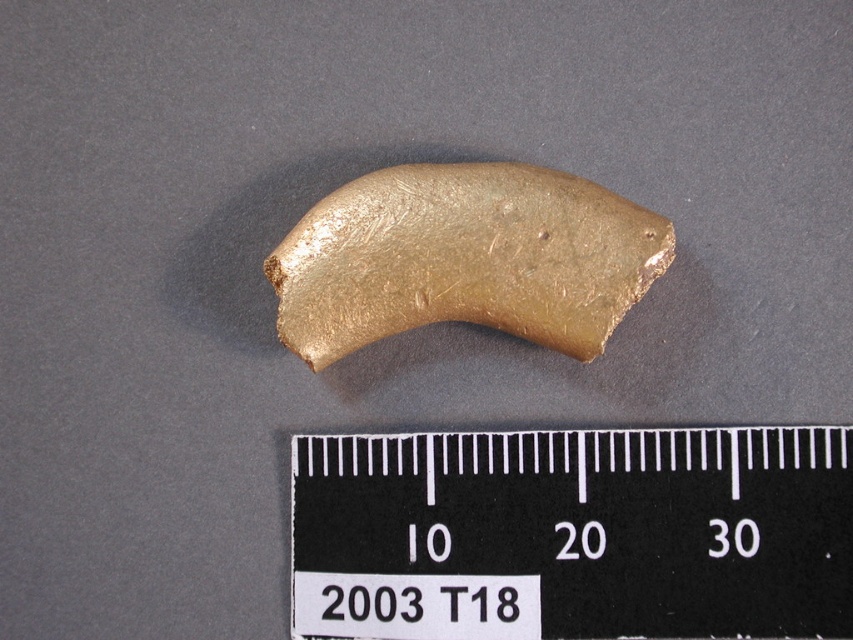
Question: Can you confirm if black plastic ruler at center is smaller than gold metallic arc at center?

Choices:
 (A) no
 (B) yes

Answer: (A)

Question: Does black plastic ruler at center lie in front of gold metallic arc at center?

Choices:
 (A) yes
 (B) no

Answer: (A)

Question: Is black plastic ruler at center positioned behind gold metallic arc at center?

Choices:
 (A) no
 (B) yes

Answer: (A)

Question: Which point is closer to the camera taking this photo?

Choices:
 (A) click(354, 513)
 (B) click(300, 260)

Answer: (B)